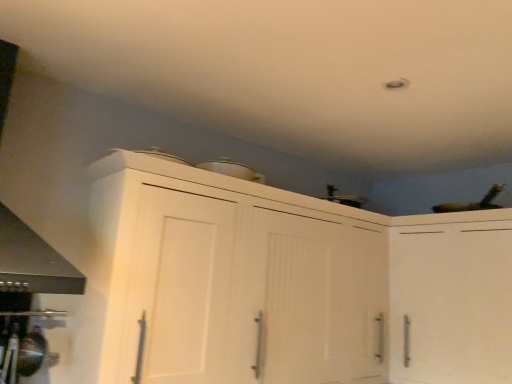
Image resolution: width=512 pixels, height=384 pixels. What do you see at coordinates (451, 297) in the screenshot? I see `white matte cabinet at upper right, the 1th cabinetry when ordered from right to left` at bounding box center [451, 297].

This screenshot has width=512, height=384. I want to click on white matte cabinet at upper right, the 1th cabinetry when ordered from right to left, so click(x=451, y=297).

What is the approximate height of white matte cabinet at upper center, which appears as the 2th cabinetry when viewed from the right?

32.52 inches.

What do you see at coordinates (293, 284) in the screenshot?
I see `white matte cabinet at upper center, which is counted as the first cabinetry, starting from the left` at bounding box center [293, 284].

This screenshot has height=384, width=512. What are the coordinates of `white matte cabinet at upper center, which appears as the 2th cabinetry when viewed from the right` in the screenshot? It's located at pos(293,284).

Image resolution: width=512 pixels, height=384 pixels. Identify the location of white matte cabinet at upper right, the 1th cabinetry when ordered from right to left. (451, 297).

Looking at this image, is white matte cabinet at upper center, which appears as the 2th cabinetry when viewed from the right, to the right of white matte cabinet at upper right, the 2th cabinetry in the left-to-right sequence, from the viewer's perspective?

No, white matte cabinet at upper center, which appears as the 2th cabinetry when viewed from the right, is not to the right of white matte cabinet at upper right, the 2th cabinetry in the left-to-right sequence.

Between white matte cabinet at upper center, which appears as the 2th cabinetry when viewed from the right, and white matte cabinet at upper right, the 1th cabinetry when ordered from right to left, which one is positioned in front?

white matte cabinet at upper center, which appears as the 2th cabinetry when viewed from the right, is closer to the camera.

Between point (437, 353) and point (505, 349), which one is positioned behind?

The point (437, 353) is farther from the camera.

From the image's perspective, who appears lower, white matte cabinet at upper center, which appears as the 2th cabinetry when viewed from the right, or white matte cabinet at upper right, the 2th cabinetry in the left-to-right sequence?

white matte cabinet at upper right, the 2th cabinetry in the left-to-right sequence, appears lower in the image.

From a real-world perspective, does white matte cabinet at upper center, which is counted as the first cabinetry, starting from the left, sit lower than white matte cabinet at upper right, the 1th cabinetry when ordered from right to left?

Actually, white matte cabinet at upper center, which is counted as the first cabinetry, starting from the left, is physically above white matte cabinet at upper right, the 1th cabinetry when ordered from right to left, in the real world.

Does white matte cabinet at upper center, which appears as the 2th cabinetry when viewed from the right, have a greater width compared to white matte cabinet at upper right, the 1th cabinetry when ordered from right to left?

Incorrect, the width of white matte cabinet at upper center, which appears as the 2th cabinetry when viewed from the right, does not surpass that of white matte cabinet at upper right, the 1th cabinetry when ordered from right to left.

Who is shorter, white matte cabinet at upper center, which appears as the 2th cabinetry when viewed from the right, or white matte cabinet at upper right, the 2th cabinetry in the left-to-right sequence?

Standing shorter between the two is white matte cabinet at upper right, the 2th cabinetry in the left-to-right sequence.

Considering the sizes of white matte cabinet at upper center, which appears as the 2th cabinetry when viewed from the right, and white matte cabinet at upper right, the 1th cabinetry when ordered from right to left, in the image, is white matte cabinet at upper center, which appears as the 2th cabinetry when viewed from the right, bigger or smaller than white matte cabinet at upper right, the 1th cabinetry when ordered from right to left,?

white matte cabinet at upper center, which appears as the 2th cabinetry when viewed from the right, is bigger than white matte cabinet at upper right, the 1th cabinetry when ordered from right to left.

Does white matte cabinet at upper center, which appears as the 2th cabinetry when viewed from the right, contain white matte cabinet at upper right, the 2th cabinetry in the left-to-right sequence?

Definitely not — white matte cabinet at upper right, the 2th cabinetry in the left-to-right sequence, is not inside white matte cabinet at upper center, which appears as the 2th cabinetry when viewed from the right.

Is there a large distance between white matte cabinet at upper center, which is counted as the first cabinetry, starting from the left, and white matte cabinet at upper right, the 1th cabinetry when ordered from right to left?

Actually, white matte cabinet at upper center, which is counted as the first cabinetry, starting from the left, and white matte cabinet at upper right, the 1th cabinetry when ordered from right to left, are a little close together.

Could you tell me if white matte cabinet at upper center, which appears as the 2th cabinetry when viewed from the right, is turned towards white matte cabinet at upper right, the 2th cabinetry in the left-to-right sequence?

Yes, white matte cabinet at upper center, which appears as the 2th cabinetry when viewed from the right, is oriented towards white matte cabinet at upper right, the 2th cabinetry in the left-to-right sequence.

What's the angular difference between white matte cabinet at upper center, which is counted as the first cabinetry, starting from the left, and white matte cabinet at upper right, the 2th cabinetry in the left-to-right sequence,'s facing directions?

white matte cabinet at upper center, which is counted as the first cabinetry, starting from the left, and white matte cabinet at upper right, the 2th cabinetry in the left-to-right sequence, are facing 88.2 degrees away from each other.

Measure the distance from white matte cabinet at upper center, which appears as the 2th cabinetry when viewed from the right, to white matte cabinet at upper right, the 2th cabinetry in the left-to-right sequence.

white matte cabinet at upper center, which appears as the 2th cabinetry when viewed from the right, is 25.35 centimeters from white matte cabinet at upper right, the 2th cabinetry in the left-to-right sequence.

At what (x,y) coordinates should I click in order to perform the action: click on cabinetry that is above the white matte cabinet at upper right, the 2th cabinetry in the left-to-right sequence (from a real-world perspective). Please return your answer as a coordinate pair (x, y). Looking at the image, I should click on (293, 284).

Is white matte cabinet at upper right, the 2th cabinetry in the left-to-right sequence, to the left of white matte cabinet at upper center, which appears as the 2th cabinetry when viewed from the right, from the viewer's perspective?

Incorrect, white matte cabinet at upper right, the 2th cabinetry in the left-to-right sequence, is not on the left side of white matte cabinet at upper center, which appears as the 2th cabinetry when viewed from the right.

Is the depth of white matte cabinet at upper right, the 1th cabinetry when ordered from right to left, less than that of white matte cabinet at upper center, which is counted as the first cabinetry, starting from the left?

No, it is not.

Which is closer, [399,272] or [203,176]?

The point [203,176] is more forward.

From the image's perspective, which object appears higher, white matte cabinet at upper right, the 1th cabinetry when ordered from right to left, or white matte cabinet at upper center, which is counted as the first cabinetry, starting from the left?

white matte cabinet at upper center, which is counted as the first cabinetry, starting from the left, is shown above in the image.

From a real-world perspective, between white matte cabinet at upper right, the 1th cabinetry when ordered from right to left, and white matte cabinet at upper center, which appears as the 2th cabinetry when viewed from the right, who is vertically higher?

In real-world perspective, white matte cabinet at upper center, which appears as the 2th cabinetry when viewed from the right, is above.

Can you confirm if white matte cabinet at upper right, the 2th cabinetry in the left-to-right sequence, is wider than white matte cabinet at upper center, which appears as the 2th cabinetry when viewed from the right?

Yes.

Does white matte cabinet at upper right, the 1th cabinetry when ordered from right to left, have a greater height compared to white matte cabinet at upper center, which is counted as the first cabinetry, starting from the left?

No.

Is white matte cabinet at upper right, the 2th cabinetry in the left-to-right sequence, smaller than white matte cabinet at upper center, which is counted as the first cabinetry, starting from the left?

Correct, white matte cabinet at upper right, the 2th cabinetry in the left-to-right sequence, occupies less space than white matte cabinet at upper center, which is counted as the first cabinetry, starting from the left.

Is white matte cabinet at upper right, the 2th cabinetry in the left-to-right sequence, situated inside white matte cabinet at upper center, which is counted as the first cabinetry, starting from the left, or outside?

The correct answer is: outside.

Does white matte cabinet at upper right, the 2th cabinetry in the left-to-right sequence, touch white matte cabinet at upper center, which appears as the 2th cabinetry when viewed from the right?

No, white matte cabinet at upper right, the 2th cabinetry in the left-to-right sequence, is not next to white matte cabinet at upper center, which appears as the 2th cabinetry when viewed from the right.

Is white matte cabinet at upper right, the 2th cabinetry in the left-to-right sequence, oriented away from white matte cabinet at upper center, which is counted as the first cabinetry, starting from the left?

No, white matte cabinet at upper center, which is counted as the first cabinetry, starting from the left, is not at the back of white matte cabinet at upper right, the 2th cabinetry in the left-to-right sequence.

Can you tell me how much white matte cabinet at upper right, the 1th cabinetry when ordered from right to left, and white matte cabinet at upper center, which appears as the 2th cabinetry when viewed from the right, differ in facing direction?

88.2 degrees.

Measure the distance between white matte cabinet at upper right, the 2th cabinetry in the left-to-right sequence, and white matte cabinet at upper center, which appears as the 2th cabinetry when viewed from the right.

9.98 inches.

Where is `cabinetry that appears behind the white matte cabinet at upper center, which is counted as the first cabinetry, starting from the left`? cabinetry that appears behind the white matte cabinet at upper center, which is counted as the first cabinetry, starting from the left is located at coordinates (451, 297).

You are a GUI agent. You are given a task and a screenshot of the screen. Output one action in this format:
    pyautogui.click(x=<x>, y=<y>)
    Task: Click on the cabinetry above the white matte cabinet at upper right, the 1th cabinetry when ordered from right to left (from the image's perspective)
    Image resolution: width=512 pixels, height=384 pixels.
    Given the screenshot: What is the action you would take?
    pyautogui.click(x=293, y=284)

This screenshot has height=384, width=512. Find the location of `cabinetry below the white matte cabinet at upper center, which appears as the 2th cabinetry when viewed from the right (from a real-world perspective)`. cabinetry below the white matte cabinet at upper center, which appears as the 2th cabinetry when viewed from the right (from a real-world perspective) is located at coordinates (451, 297).